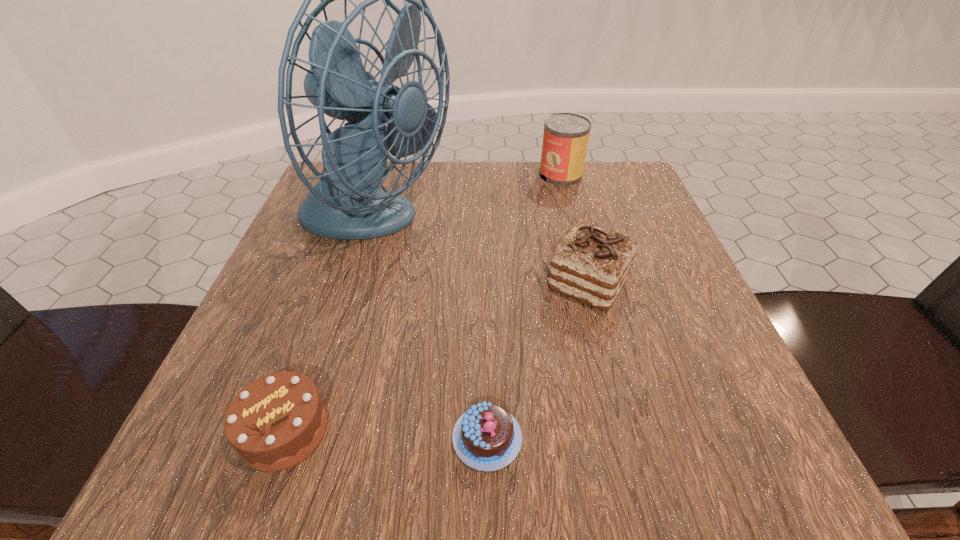
Locate an element on the screen. The image size is (960, 540). the fourth closest object to the fan is located at coordinates (486, 437).

The width and height of the screenshot is (960, 540). Identify the location of the closest chocolate cake to the can. (591, 264).

This screenshot has width=960, height=540. Find the location of `chocolate cake that can be found as the third closest to the can`. chocolate cake that can be found as the third closest to the can is located at coordinates [275, 422].

Locate an element on the screen. This screenshot has width=960, height=540. blank area in the image that satisfies the following two spatial constraints: 1. in front of the fan to blow air; 2. on the back side of the tallest chocolate cake is located at coordinates (357, 284).

Identify the location of vacant area that satisfies the following two spatial constraints: 1. on the front side of the second tallest chocolate cake; 2. on the right side of the third object from right to left. This screenshot has width=960, height=540. (282, 438).

Locate an element on the screen. This screenshot has height=540, width=960. free space that satisfies the following two spatial constraints: 1. in front of the fan to blow air; 2. on the left side of the farthest chocolate cake is located at coordinates (357, 284).

This screenshot has width=960, height=540. Find the location of `free space that satisfies the following two spatial constraints: 1. on the back side of the rightmost chocolate cake; 2. in front of the tallest object to blow air`. free space that satisfies the following two spatial constraints: 1. on the back side of the rightmost chocolate cake; 2. in front of the tallest object to blow air is located at coordinates (573, 225).

You are a GUI agent. You are given a task and a screenshot of the screen. Output one action in this format:
    pyautogui.click(x=<x>, y=<y>)
    Task: Click on the free point that satisfies the following two spatial constraints: 1. in front of the fan to blow air; 2. on the left side of the second chocolate cake from left to right
    This screenshot has height=540, width=960.
    Given the screenshot: What is the action you would take?
    [312, 438]